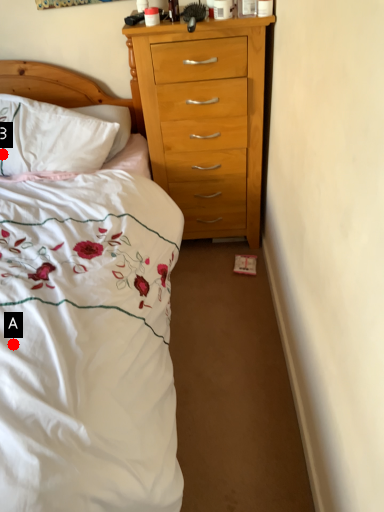
Question: Two points are circled on the image, labeled by A and B beside each circle. Which point is further to the camera?

Choices:
 (A) A is further
 (B) B is further

Answer: (B)